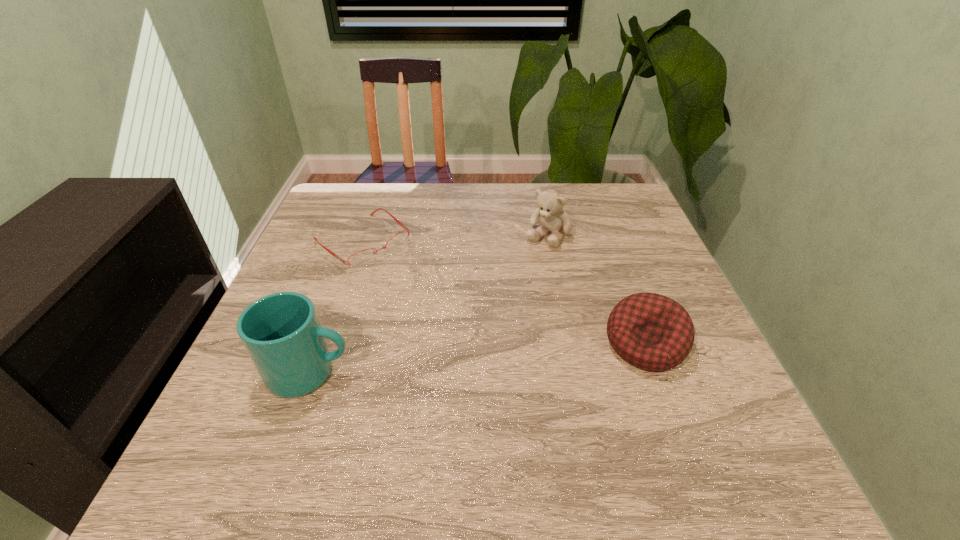
The image size is (960, 540). Find the location of `free space between the cup and the shortest object`. free space between the cup and the shortest object is located at coordinates (336, 307).

Locate an element on the screen. vacant space that is in between the third object from left to right and the beanbag is located at coordinates (596, 289).

Locate an element on the screen. The width and height of the screenshot is (960, 540). vacant region between the rightmost object and the cup is located at coordinates (477, 358).

This screenshot has height=540, width=960. I want to click on free space between the third tallest object and the cup, so click(477, 358).

The height and width of the screenshot is (540, 960). I want to click on free space between the shortest object and the cup, so click(x=336, y=307).

Identify which object is the third closest to the second object from right to left. Please provide its 2D coordinates. Your answer should be formatted as a tuple, i.e. [(x, y)], where the tuple contains the x and y coordinates of a point satisfying the conditions above.

[(281, 332)]

Where is `object that stands as the closest to the teddy bear`? object that stands as the closest to the teddy bear is located at coordinates (652, 332).

Find the location of a particular element. This screenshot has height=540, width=960. vacant region that satisfies the following two spatial constraints: 1. on the front side of the second shortest object; 2. on the right side of the third object from left to right is located at coordinates (568, 343).